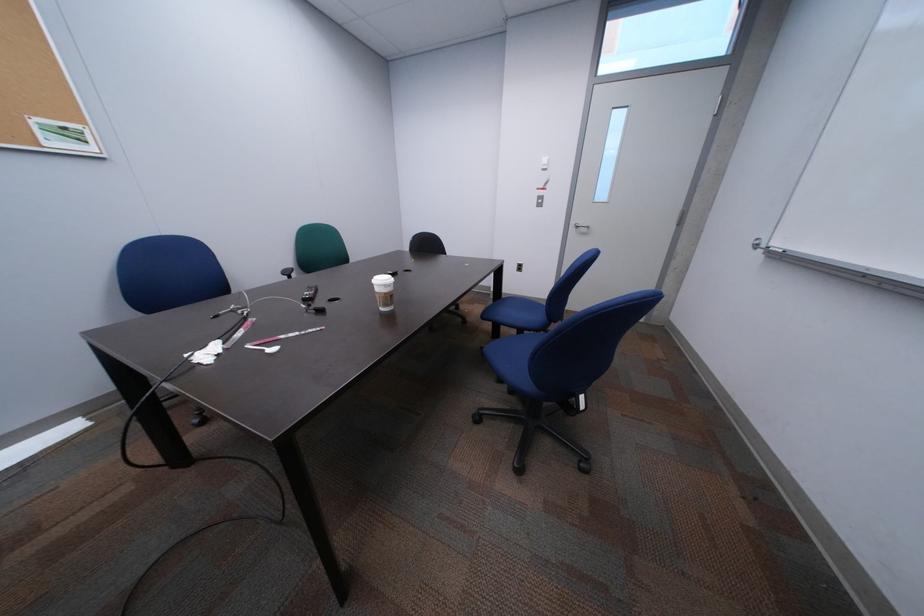
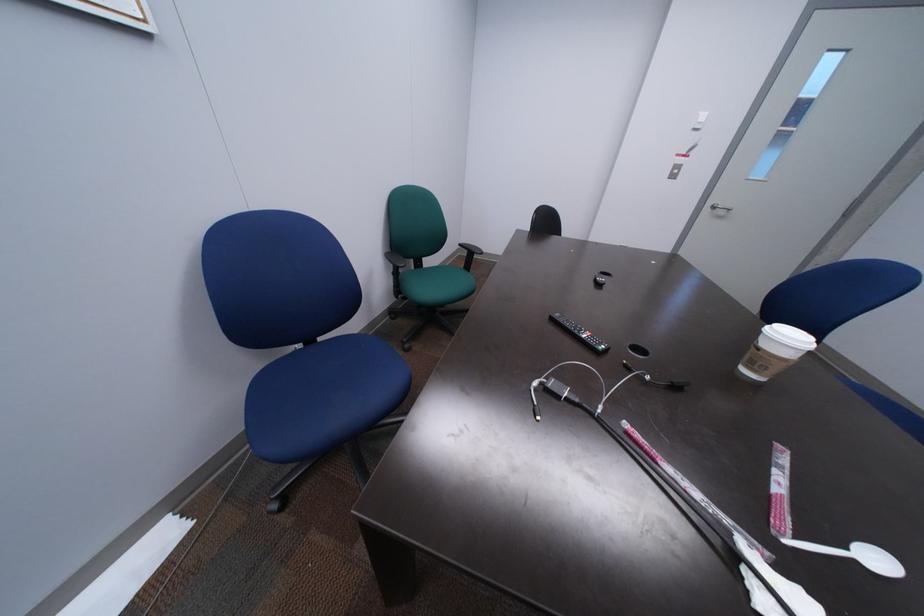
In a continuous first-person perspective shot, in which direction is the camera moving?

The cameraman walked toward left, forward.